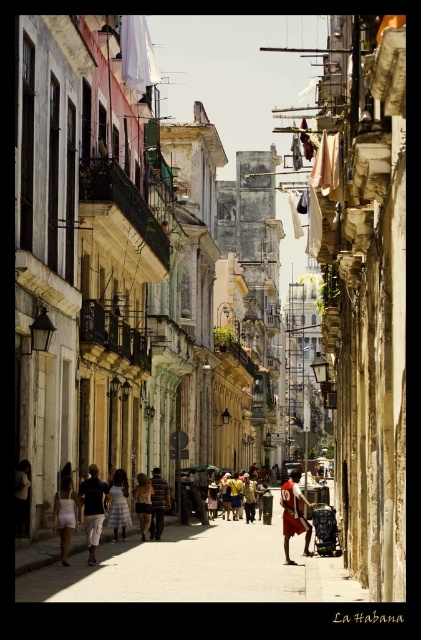
You are a photographer standing in the alleyway in La Habana, Cuba. You notice two people dressed in dark brown pants at center and white lace dress at center. Which person is positioned higher up in the scene?

The dark brown pants at center is located above the white lace dress at center, so the person wearing the dark brown pants at center is positioned higher up in the scene.

From the picture: You are a photographer standing in the middle of the matte concrete alley at center. You want to capture a photo of the red fabric shorts at center without including the alley in the background. Is the size of the alley a problem for your shot?

The matte concrete alley at center is larger in size than the red fabric shorts at center, so the alley might still be visible in the background unless you adjust your angle or zoom in to focus solely on the red fabric shorts at center.